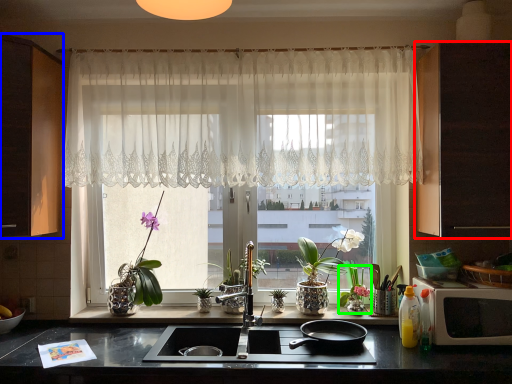
Question: Considering the real-world distances, which object is closest to cabinetry (highlighted by a red box)? cabinetry (highlighted by a blue box) or floral arrangement (highlighted by a green box).

Choices:
 (A) cabinetry
 (B) floral arrangement

Answer: (B)